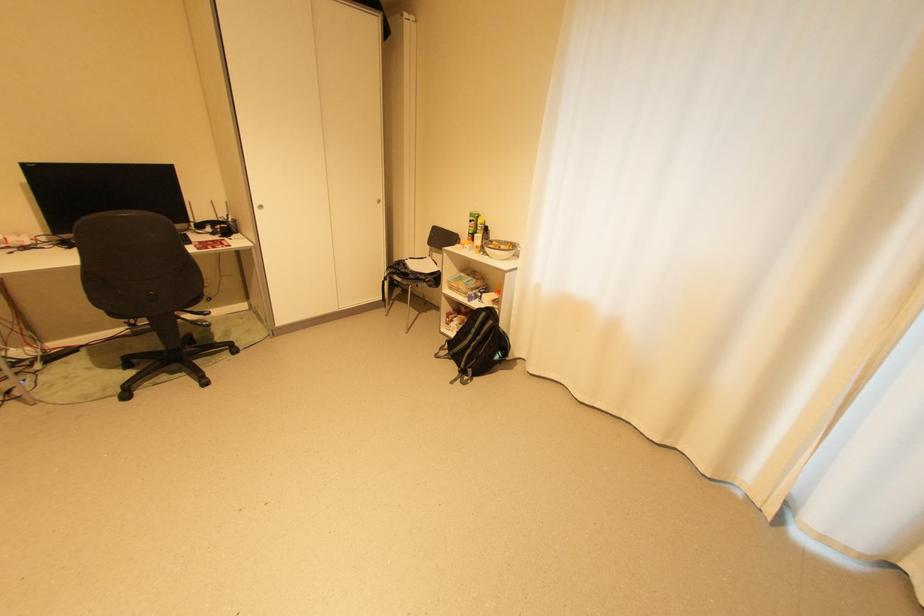
Locate an element on the screen. This screenshot has width=924, height=616. silver cabinet handle is located at coordinates (260, 207).